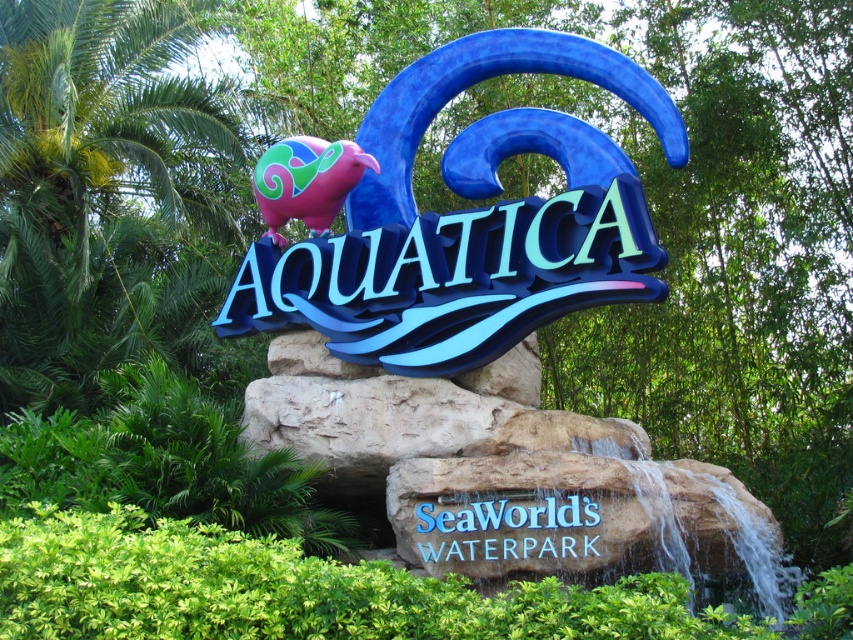
Question: Can you confirm if glossy plastic sign at center is wider than blue plastic sign at center?

Choices:
 (A) yes
 (B) no

Answer: (A)

Question: Is the position of glossy plastic sign at center more distant than that of blue plastic sign at center?

Choices:
 (A) no
 (B) yes

Answer: (B)

Question: Which of the following is the farthest from the observer?

Choices:
 (A) (587, 522)
 (B) (618, 225)

Answer: (B)

Question: Considering the relative positions of glossy plastic sign at center and blue plastic sign at center in the image provided, where is glossy plastic sign at center located with respect to blue plastic sign at center?

Choices:
 (A) below
 (B) above

Answer: (B)

Question: Which of the following is the farthest from the observer?

Choices:
 (A) (590, 541)
 (B) (525, 248)

Answer: (B)